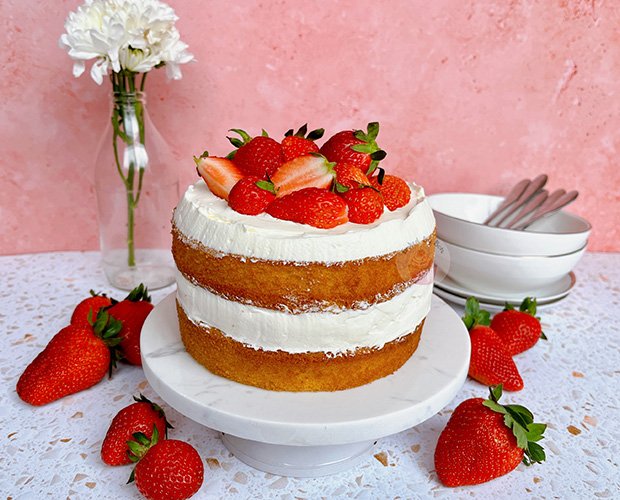
Where is `marble`? marble is located at coordinates (193, 395).